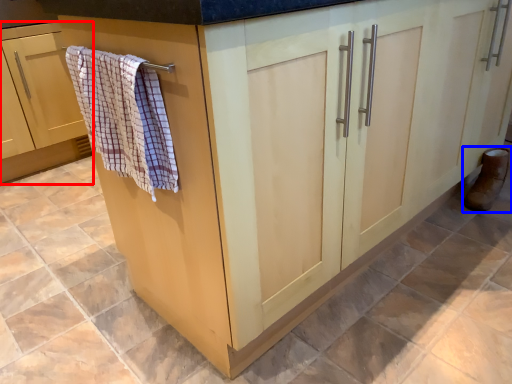
Question: Which object is closer to the camera taking this photo, cabinetry (highlighted by a red box) or footwear (highlighted by a blue box)?

Choices:
 (A) cabinetry
 (B) footwear

Answer: (B)